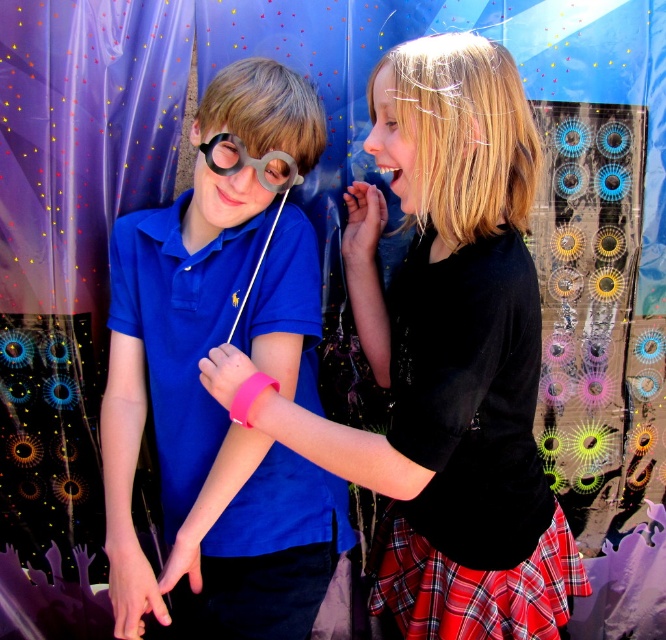
From the picture: You are a photographer setting up for a group photo. You need to position the black matte dress at center so that it aligns with the point at coordinates (444, 356). Can you confirm if the black matte dress at center is already positioned correctly?

The point at coordinates (444, 356) indicates the position of the black matte dress at center, so yes, it is already correctly positioned there.

You are a photographer trying to capture a clear photo of the blue matte shirt at center and the black paper at center. Which object should you focus on first to ensure both are in focus?

The black paper at center is behind the blue matte shirt at center, so you should focus on the blue matte shirt at center first to ensure both are in focus.

You are a photographer setting up for a group photo. You have two subjects wearing the black matte dress at center and the blue matte shirt at center. You want to ensure both are visible in the frame. Which subject should you position closer to the camera to avoid one being obscured by the other?

The black matte dress at center is much taller than the blue matte shirt at center, so you should position the blue matte shirt at center closer to the camera to prevent the taller black matte dress at center from obscuring it.